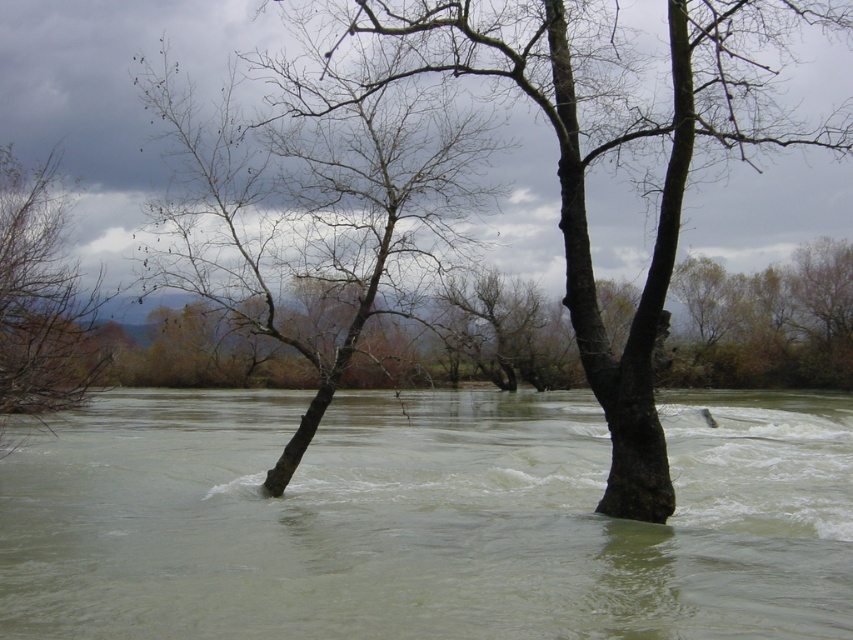
You are standing at the point labeled point (16, 172) and want to move towards the point labeled point (221, 257). Given the flooded area with turbulent water, which direction should you move to reach your destination safely?

To move from point (16, 172) to point (221, 257) safely, you should head towards the point labeled point (221, 257) since it is closer to you. However, the flooded area with turbulent water may pose risks, so proceed with caution.